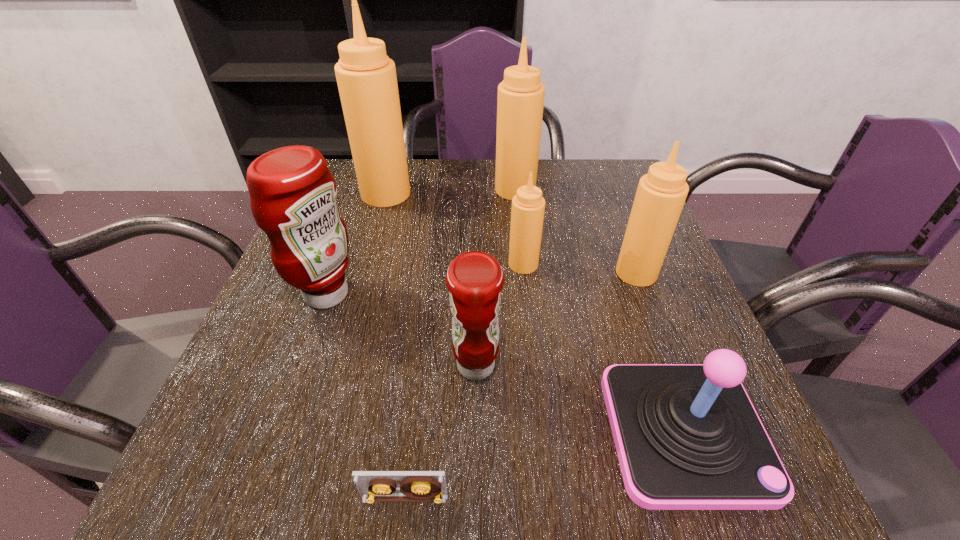
The width and height of the screenshot is (960, 540). I want to click on free region at the far right corner of the desktop, so click(607, 197).

Where is `free spot between the right red condiment and the smallest tan condiment`? This screenshot has height=540, width=960. free spot between the right red condiment and the smallest tan condiment is located at coordinates (499, 315).

This screenshot has height=540, width=960. I want to click on free point between the shortest object and the rightmost tan condiment, so click(x=520, y=386).

Where is `free point between the rightmost tan condiment and the nearest condiment`? Image resolution: width=960 pixels, height=540 pixels. free point between the rightmost tan condiment and the nearest condiment is located at coordinates (556, 319).

Where is `unoccupied position between the smallest tan condiment and the joystick`? unoccupied position between the smallest tan condiment and the joystick is located at coordinates (604, 348).

You are a GUI agent. You are given a task and a screenshot of the screen. Output one action in this format:
    pyautogui.click(x=<x>, y=<y>)
    Task: Click on the empty space that is in between the bigger red condiment and the leftmost tan condiment
    The height and width of the screenshot is (540, 960).
    Given the screenshot: What is the action you would take?
    pyautogui.click(x=356, y=244)

Find the location of `free spot between the leftmost tan condiment and the brown videotape`. free spot between the leftmost tan condiment and the brown videotape is located at coordinates (396, 346).

This screenshot has width=960, height=540. What are the coordinates of `vacant area between the nearer red condiment and the brown videotape` in the screenshot? It's located at coord(441,432).

Identify which object is located as the fifth nearest to the joystick. Please provide its 2D coordinates. Your answer should be formatted as a tuple, i.e. [(x, y)], where the tuple contains the x and y coordinates of a point satisfying the conditions above.

[(293, 193)]

Choose which object is the seventh nearest neighbor to the fourth condiment from right to left. Please provide its 2D coordinates. Your answer should be formatted as a tuple, i.e. [(x, y)], where the tuple contains the x and y coordinates of a point satisfying the conditions above.

[(520, 101)]